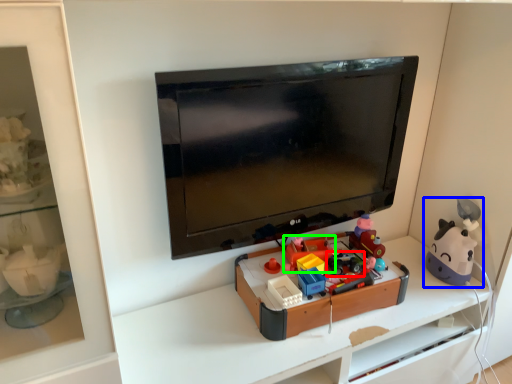
Question: Which object is positioned closest to toy (highlighted by a red box)? Select from toy (highlighted by a blue box) and toy (highlighted by a green box).

Choices:
 (A) toy
 (B) toy

Answer: (B)